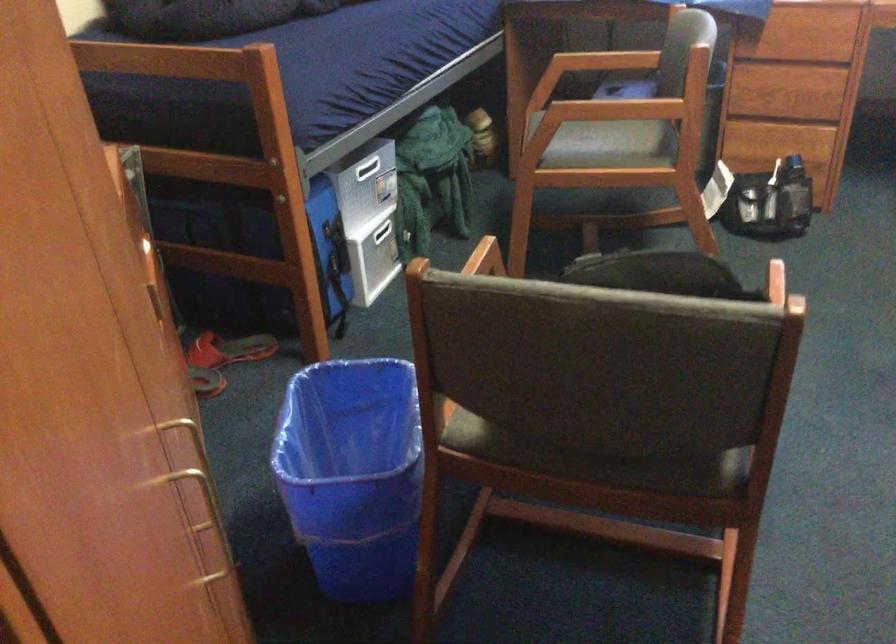
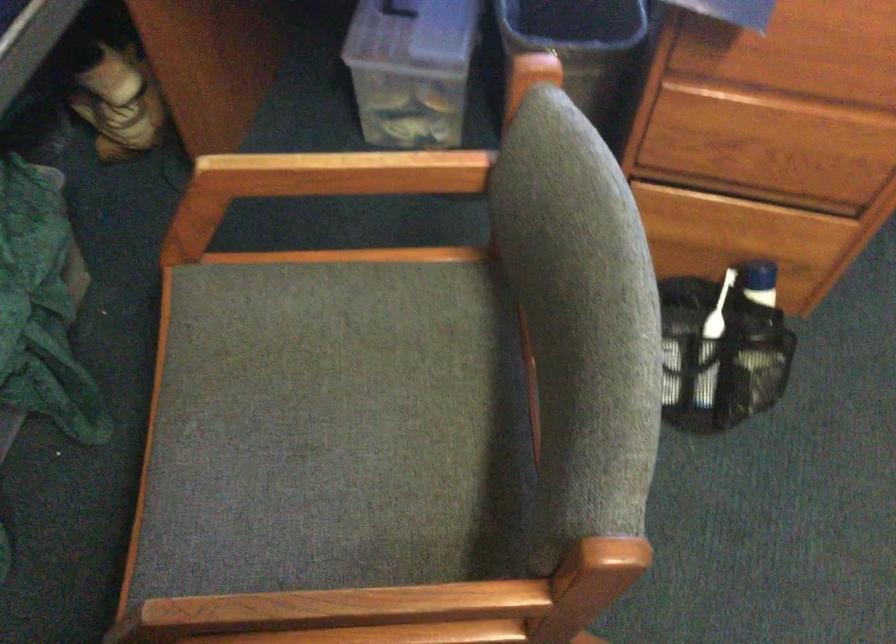
In the second image, find the point that corresponds to the point at 606,115 in the first image.

(338, 611)